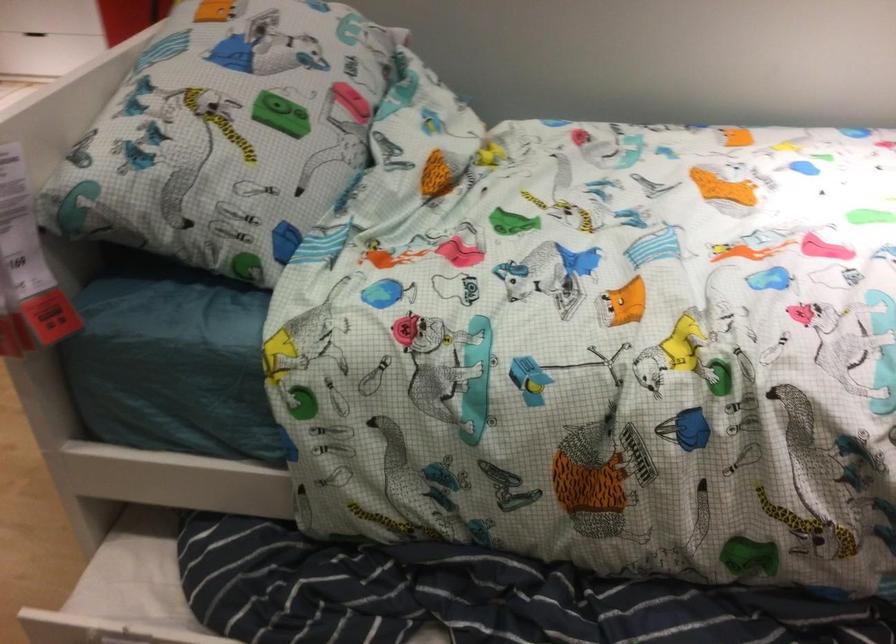
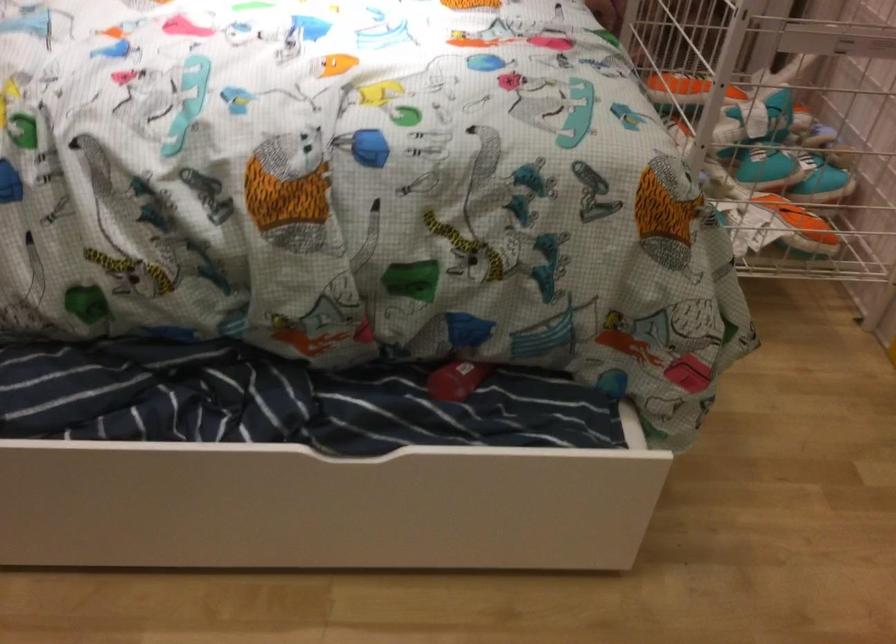
Question: How did the camera likely rotate?

Choices:
 (A) Left
 (B) Right
 (C) Up
 (D) Down

Answer: (B)